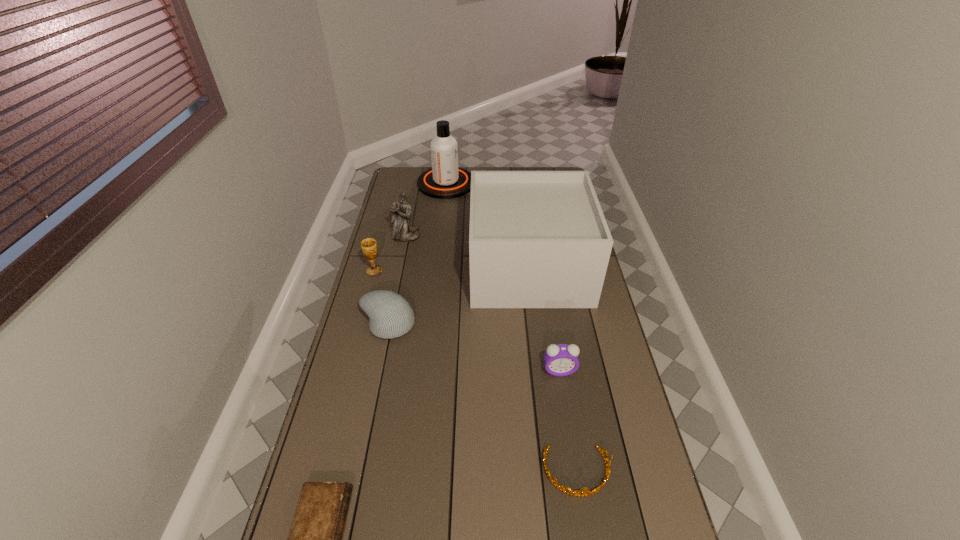
Find the location of a particular element. vacant region located 0.300m on the side of the box with the window is located at coordinates (397, 267).

Identify the location of vacant space located 0.100m on the front-facing side of the sixth shortest object. This screenshot has width=960, height=540. (402, 257).

This screenshot has height=540, width=960. What are the coordinates of `blank area located on the right of the chalice` in the screenshot? It's located at (399, 271).

Where is `free space located on the back of the beanie`? free space located on the back of the beanie is located at coordinates (396, 284).

I want to click on free location located 0.200m on the face of the third nearest object, so click(570, 436).

I want to click on vacant region located on the front-facing side of the seventh tallest object, so [587, 536].

The height and width of the screenshot is (540, 960). I want to click on object that is at the far edge, so click(x=445, y=180).

Image resolution: width=960 pixels, height=540 pixels. Find the location of `cleansing agent that is at the left edge`. cleansing agent that is at the left edge is located at coordinates (445, 180).

Find the location of a particular element. The height and width of the screenshot is (540, 960). figurine that is at the left edge is located at coordinates pyautogui.click(x=402, y=231).

Where is `chalice present at the left edge`? chalice present at the left edge is located at coordinates (369, 246).